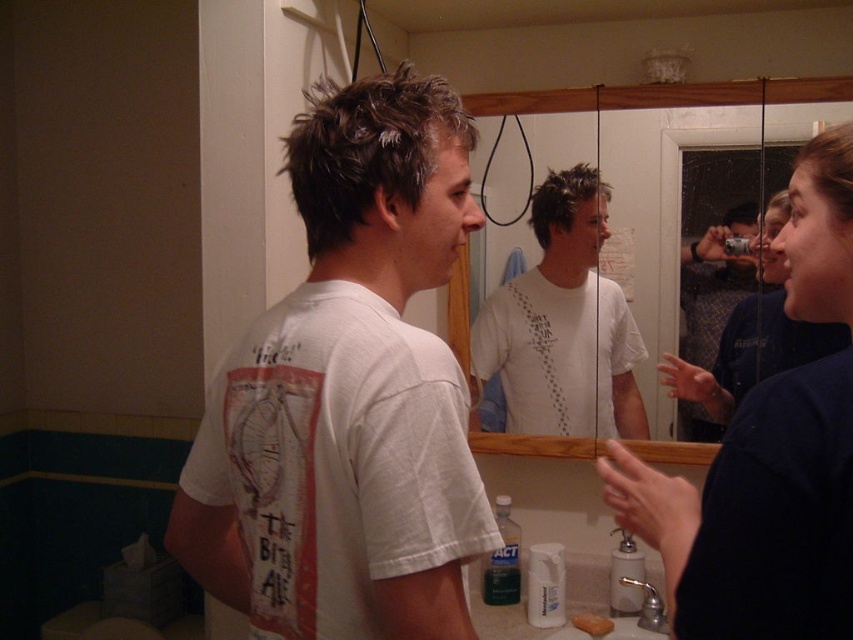
Question: Is dark blue fabric at upper right bigger than matte glass mirror at center?

Choices:
 (A) yes
 (B) no

Answer: (B)

Question: Which of the following is the farthest from the observer?

Choices:
 (A) dark blue fabric at upper right
 (B) white cotton t-shirt at center
 (C) matte glass mirror at center
 (D) white matte t-shirt at center

Answer: (D)

Question: Which object is the closest to the dark blue fabric at upper right?

Choices:
 (A) white matte t-shirt at center
 (B) matte glass mirror at center

Answer: (A)

Question: Does dark blue fabric at upper right appear on the right side of white matte t-shirt at center?

Choices:
 (A) no
 (B) yes

Answer: (B)

Question: Which is farther from the white cotton t-shirt at center?

Choices:
 (A) dark blue fabric at upper right
 (B) matte glass mirror at center

Answer: (B)

Question: Is the position of dark blue fabric at upper right less distant than that of white matte t-shirt at center?

Choices:
 (A) no
 (B) yes

Answer: (B)